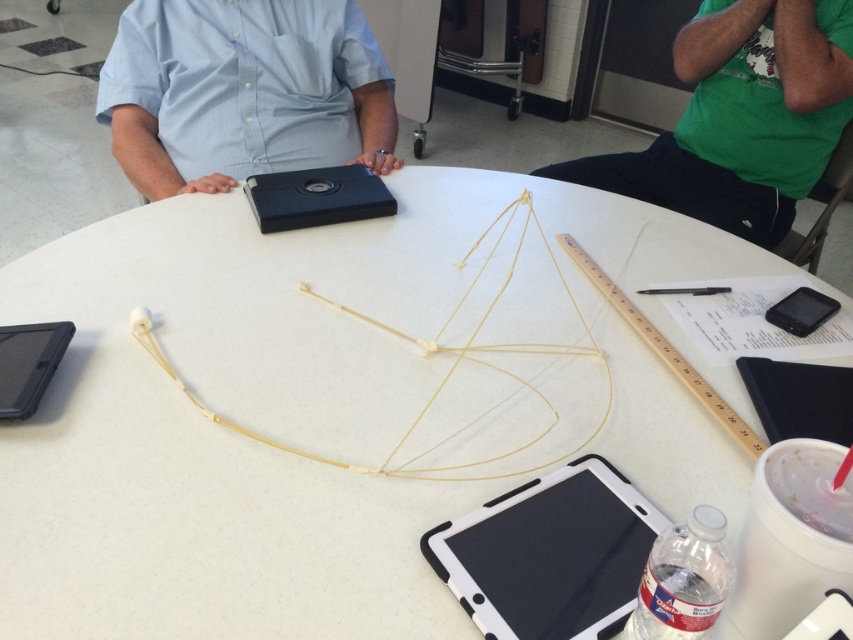
Question: Which of the following is the closest to the observer?

Choices:
 (A) black matte/ipad at lower right
 (B) black matte tablet at lower left

Answer: (A)

Question: Which of the following is the farthest from the observer?

Choices:
 (A) black matte tablet at lower left
 (B) matte blue shirt at center
 (C) white matte string at center

Answer: (B)

Question: Where is matte blue shirt at center located in relation to white rubber string at center in the image?

Choices:
 (A) below
 (B) above

Answer: (B)

Question: Is white matte string at center above green cotton shirt at upper right?

Choices:
 (A) no
 (B) yes

Answer: (A)

Question: Among these objects, which one is nearest to the camera?

Choices:
 (A) matte blue shirt at center
 (B) black matte/ipad at lower right
 (C) green cotton shirt at upper right
 (D) black matte tablet at lower left

Answer: (B)

Question: Can you confirm if green cotton shirt at upper right is thinner than white rubber string at center?

Choices:
 (A) no
 (B) yes

Answer: (A)